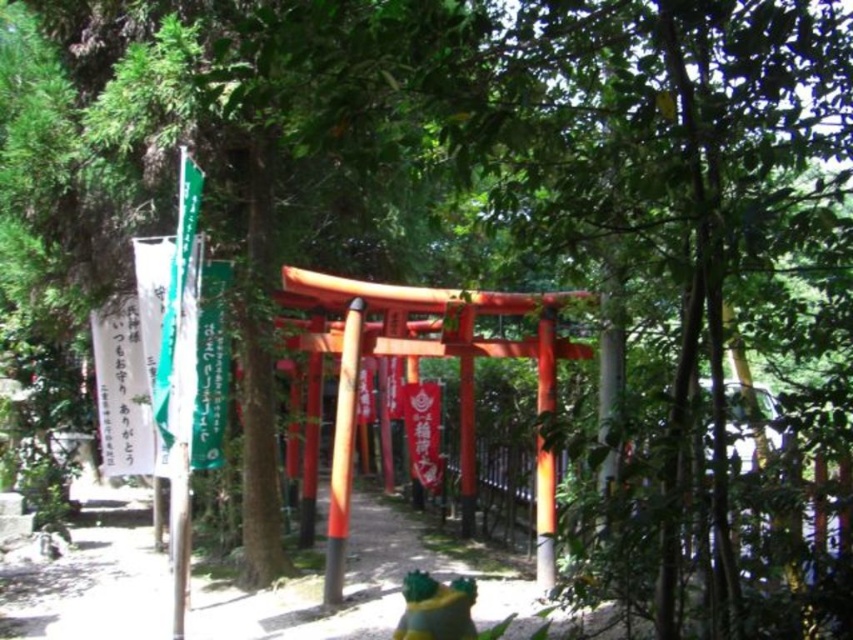
You are a visitor at a Shinto shrine and see the orange glossy pole at center and the glossy wood pole at center. Which pole do you need to look up higher to see the top of?

The orange glossy pole at center is much taller than the glossy wood pole at center, so you need to look up higher to see the top of the orange glossy pole at center.